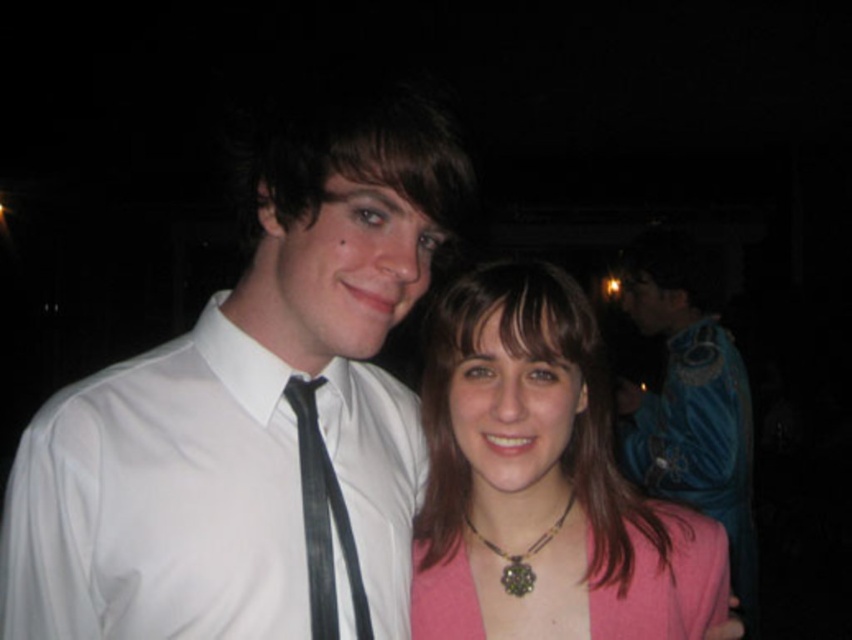
Between white smooth shirt at center and pink fabric dress at center, which one appears on the right side from the viewer's perspective?

From the viewer's perspective, pink fabric dress at center appears more on the right side.

Is point (151, 376) less distant than point (723, 609)?

Yes, point (151, 376) is in front of point (723, 609).

Who is more forward, (216,608) or (695,605)?

Point (216,608) is in front.

The image size is (852, 640). Identify the location of white smooth shirt at center. (160, 500).

Between point (246, 337) and point (473, 272), which one is positioned in front?

Positioned in front is point (246, 337).

Does point (199, 344) come behind point (481, 385)?

Yes, it is behind point (481, 385).

Locate an element on the screen. The height and width of the screenshot is (640, 852). white smooth shirt at center is located at coordinates (160, 500).

Is black satin tie at center above multicolored beaded necklace at center?

Yes, black satin tie at center is above multicolored beaded necklace at center.

Between point (340, 509) and point (573, 497), which one is positioned in front?

Point (340, 509)

The height and width of the screenshot is (640, 852). What are the coordinates of `black satin tie at center` in the screenshot? It's located at (323, 518).